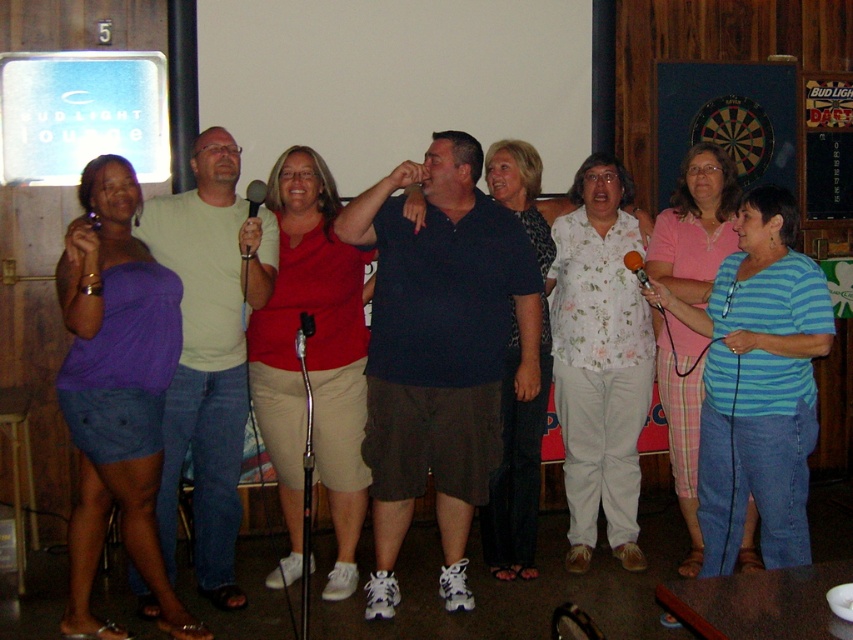
You are a photographer at the Bud Light Lounge trying to capture a candid shot of the group. You notice the floral cotton blouse at center and the matte black microphone at center. Which object should you focus on if you want to photograph the person holding the microphone?

The matte black microphone at center is on the left side of the floral cotton blouse at center. Therefore, focusing on the matte black microphone at center will capture the person holding it.